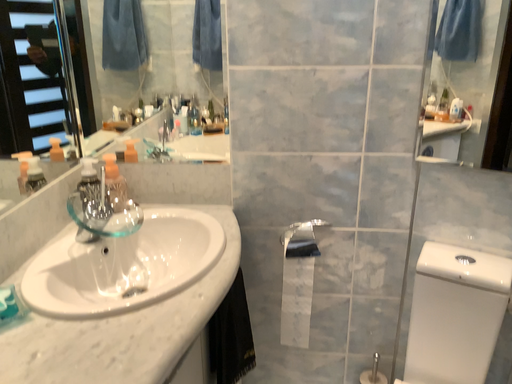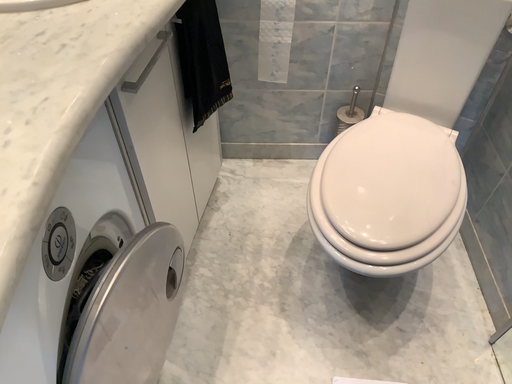
Question: How did the camera likely rotate when shooting the video?

Choices:
 (A) rotated upward
 (B) rotated downward

Answer: (B)